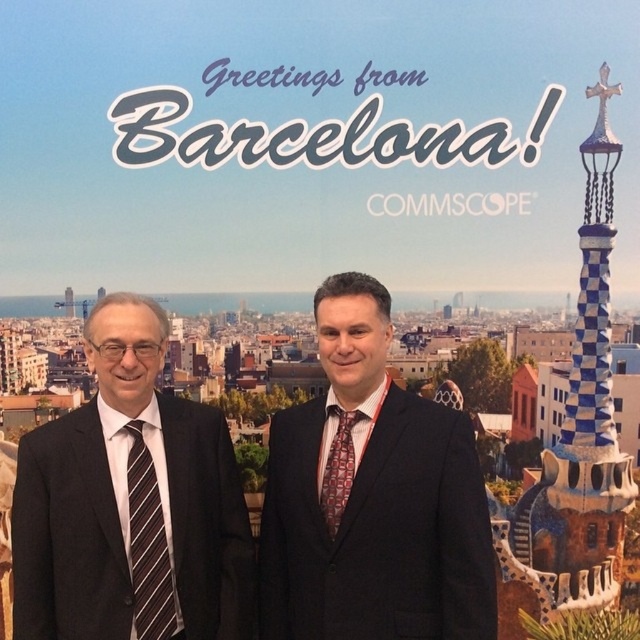
You are a photographer at the event and want to ensure that the black suit at center and the striped fabric tie at left are both visible in the photo. Based on their positions, which one is higher up in the image?

The black suit at center is higher up in the image than the striped fabric tie at left because the black suit at center is above striped fabric tie at left.

You are a photographer at the event and want to capture a photo where both the striped fabric tie at left and the patterned silk tie at center are visible. Based on their positions, which tie is closer to the bottom of the image?

The striped fabric tie at left is below the patterned silk tie at center, so the striped fabric tie at left is closer to the bottom of the image.

You are attending a formal event and need to choose a tie that is wider. Which one should you pick between the striped fabric tie at left and the patterned silk tie at center?

The striped fabric tie at left is wider than the patterned silk tie at center, so you should pick the striped fabric tie at left.